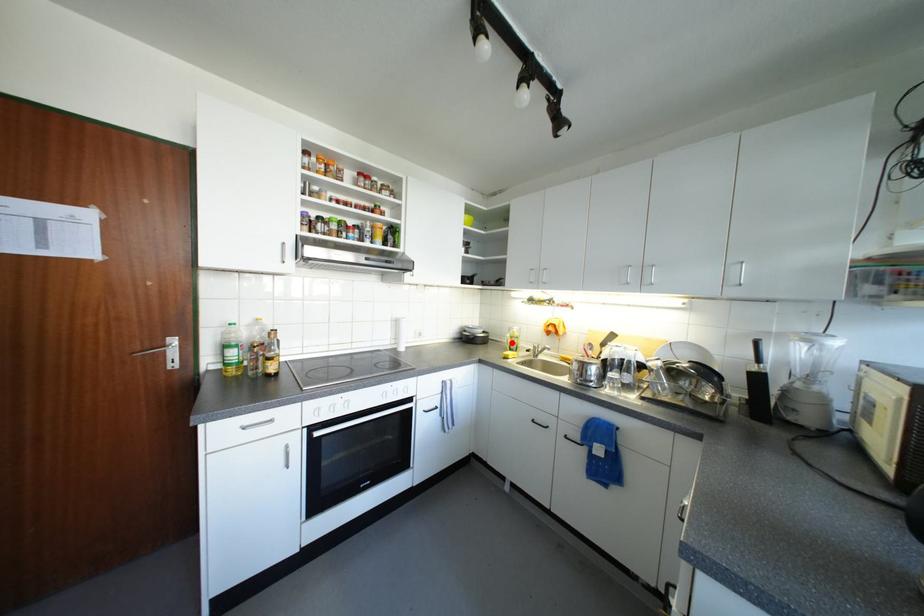
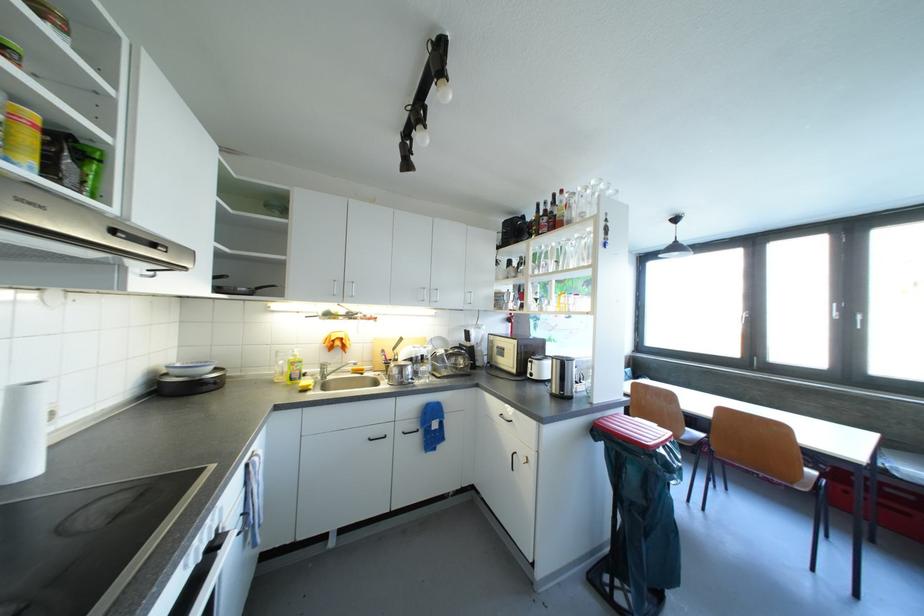
Where in the second image is the point corresponding to the highlighted location from the first image?

(283, 371)